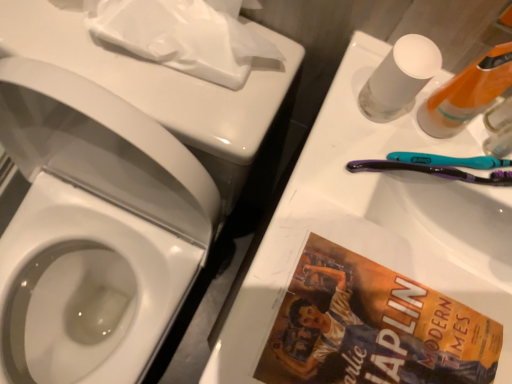
Identify the location of vacant space in front of purple plastic toothbrush at right. This screenshot has height=384, width=512. (376, 297).